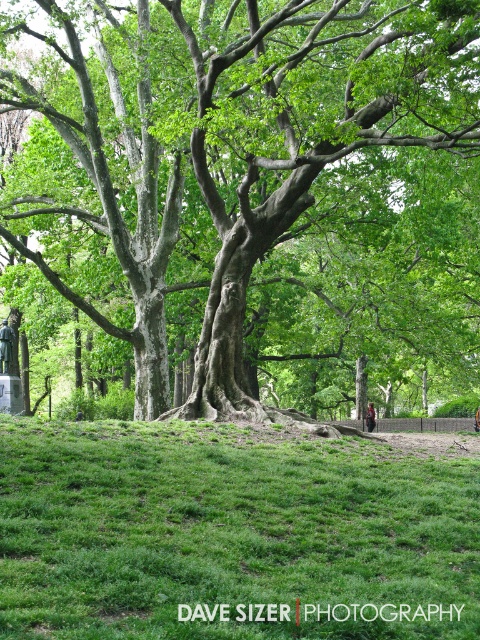
Question: Estimate the real-world distances between objects in this image. Which object is closer to the green rough bark tree at center?

Choices:
 (A) green grassy hill at lower center
 (B) brown leather backpack at lower right

Answer: (B)

Question: Does green rough bark tree at center have a smaller size compared to brown leather backpack at lower right?

Choices:
 (A) no
 (B) yes

Answer: (A)

Question: Among these points, which one is nearest to the camera?

Choices:
 (A) (367, 416)
 (B) (276, 625)

Answer: (B)

Question: Which object is the farthest from the green grassy hill at lower center?

Choices:
 (A) brown leather backpack at lower right
 (B) green rough bark tree at center

Answer: (A)

Question: Can you confirm if green grassy hill at lower center is positioned above brown leather backpack at lower right?

Choices:
 (A) yes
 (B) no

Answer: (A)

Question: Does green rough bark tree at center lie behind brown leather backpack at lower right?

Choices:
 (A) yes
 (B) no

Answer: (B)